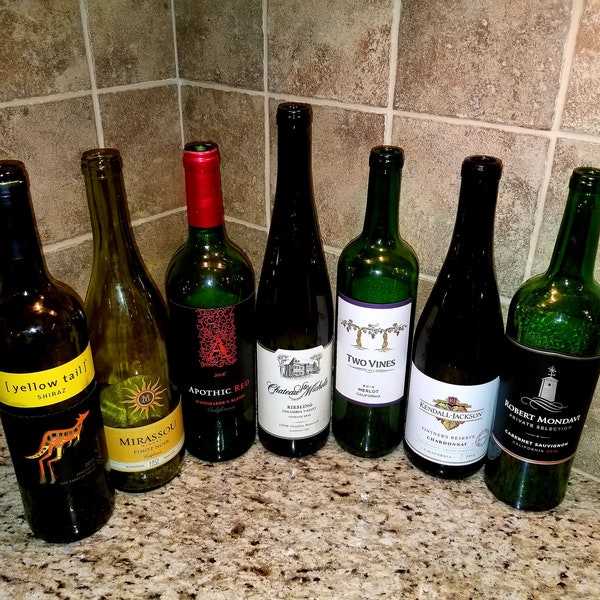
Identify the location of cabinet. (x=401, y=501).